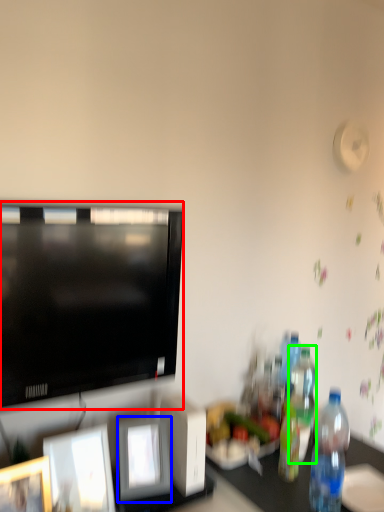
Question: Which is farther away from television (highlighted by a red box)? picture frame (highlighted by a blue box) or bottle (highlighted by a green box)?

Choices:
 (A) picture frame
 (B) bottle

Answer: (B)